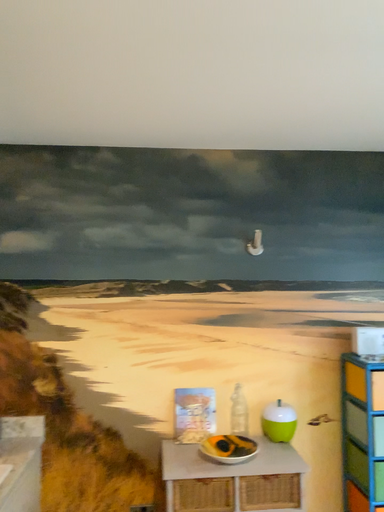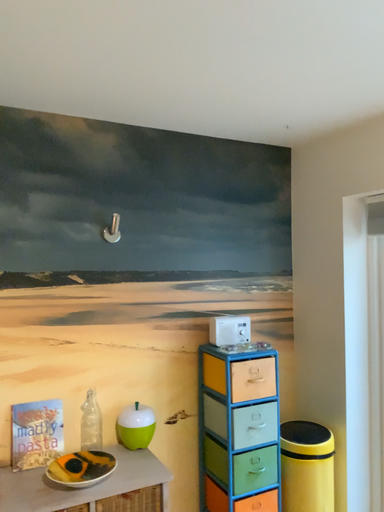
Question: How did the camera likely rotate when shooting the video?

Choices:
 (A) rotated left
 (B) rotated right

Answer: (B)